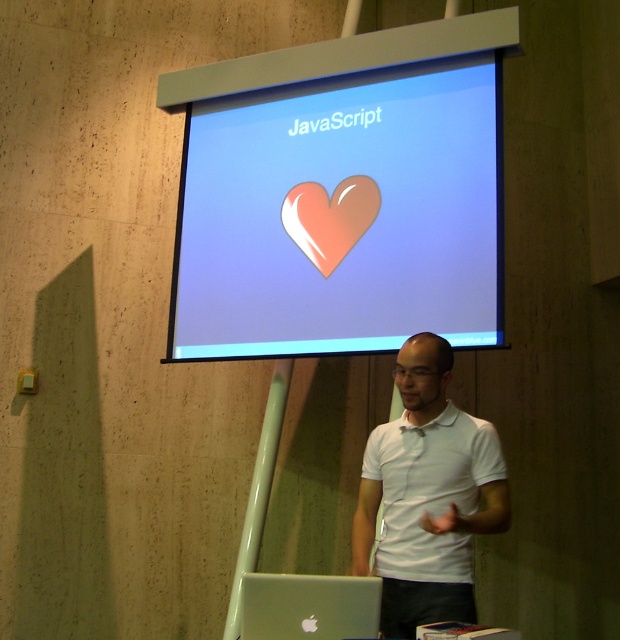
Is silver metallic laptop at lower center bigger than glossy pink heart at center?

Indeed, silver metallic laptop at lower center has a larger size compared to glossy pink heart at center.

Where is `silver metallic laptop at lower center`? This screenshot has height=640, width=620. silver metallic laptop at lower center is located at coordinates (308, 605).

Who is more distant from viewer, (308, 612) or (361, 205)?

Positioned behind is point (361, 205).

Where is `silver metallic laptop at lower center`? The height and width of the screenshot is (640, 620). silver metallic laptop at lower center is located at coordinates click(308, 605).

Is matte plastic heart at upper center taller than silver metallic laptop at lower center?

Correct, matte plastic heart at upper center is much taller as silver metallic laptop at lower center.

Who is more forward, (356, 104) or (370, 593)?

Point (370, 593) is in front.

I want to click on matte plastic heart at upper center, so click(x=342, y=214).

Is point (356, 513) closer to viewer compared to point (361, 630)?

No, (356, 513) is further to viewer.

Who is positioned more to the left, white matte shirt at center or silver metallic laptop at lower center?

From the viewer's perspective, silver metallic laptop at lower center appears more on the left side.

Is point (368, 572) farther from viewer compared to point (257, 589)?

Yes, point (368, 572) is behind point (257, 589).

The image size is (620, 640). I want to click on white matte shirt at center, so click(x=427, y=496).